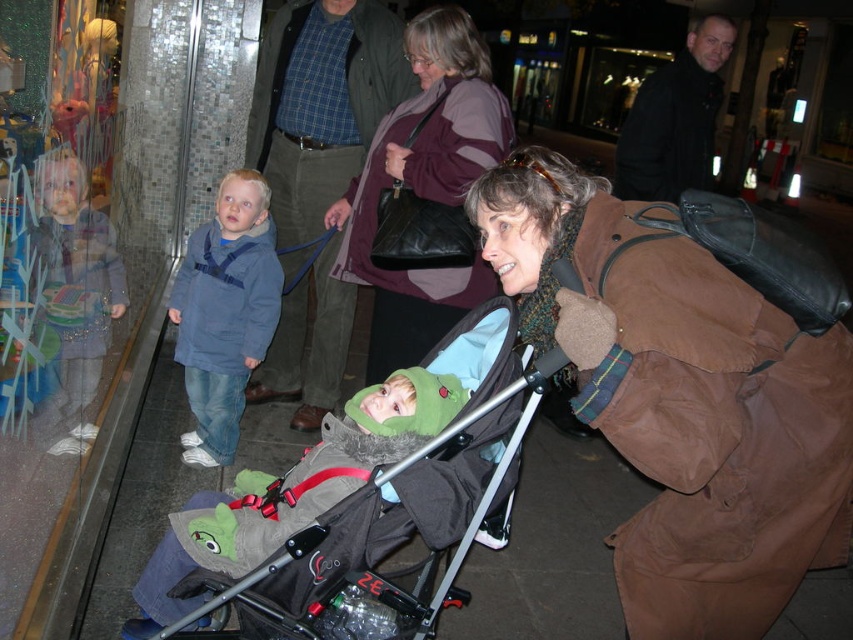
Question: Which object appears closest to the camera in this image?

Choices:
 (A) maroon sweater at center
 (B) denim jacket at left

Answer: (A)

Question: Among these objects, which one is farthest from the camera?

Choices:
 (A) maroon sweater at center
 (B) dark gray fabric stroller at center
 (C) denim jacket at left

Answer: (C)

Question: Which point is closer to the camera?

Choices:
 (A) (438, 198)
 (B) (509, 451)

Answer: (B)

Question: Can you confirm if brown fabric coat at center is thinner than dark gray fabric stroller at center?

Choices:
 (A) no
 (B) yes

Answer: (B)

Question: Is brown fabric coat at center smaller than brown leather jacket at center?

Choices:
 (A) no
 (B) yes

Answer: (B)

Question: Does denim jacket at left have a lesser width compared to dark gray fabric stroller at center?

Choices:
 (A) yes
 (B) no

Answer: (A)